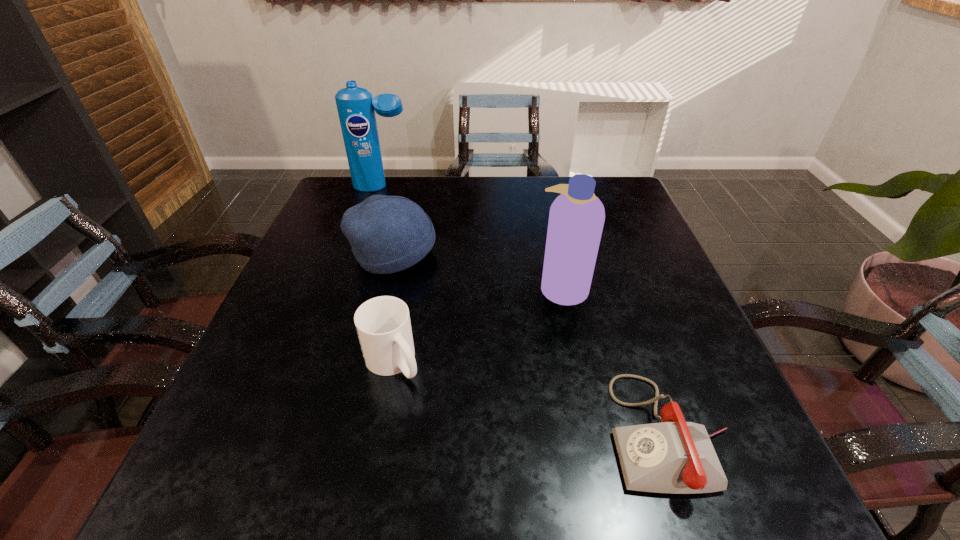
Locate an element on the screen. The width and height of the screenshot is (960, 540). vacant region located on the dial of the shortest object is located at coordinates (381, 433).

Identify the location of vacant space located on the dial of the shortest object. (487, 433).

Find the location of `blank area located on the dial of the shortest object`. blank area located on the dial of the shortest object is located at coordinates (542, 433).

The image size is (960, 540). What are the coordinates of `object at the far edge` in the screenshot? It's located at (356, 107).

Where is `object positioned at the near edge`? This screenshot has width=960, height=540. object positioned at the near edge is located at coordinates (677, 457).

Find the location of a particular element. This screenshot has width=960, height=540. shampoo situated at the left edge is located at coordinates (356, 107).

The image size is (960, 540). Identify the location of skullcap present at the left edge. (388, 234).

The width and height of the screenshot is (960, 540). I want to click on object that is at the right edge, so pos(677,457).

Locate an element on the screen. Image resolution: width=960 pixels, height=540 pixels. object that is positioned at the far left corner is located at coordinates (356, 107).

Identify the location of object that is positioned at the near right corner. Image resolution: width=960 pixels, height=540 pixels. (677, 457).